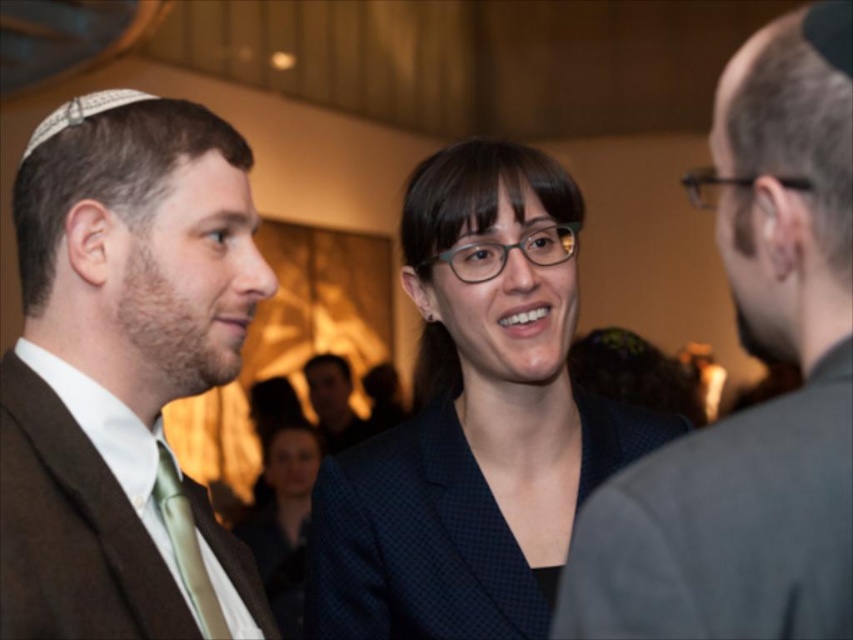
You are a photographer at this event and need to capture a group photo of the dark gray suit at center and the dark blue textured blazer at center. Which clothing item takes up more space in the photo?

The dark gray suit at center takes up more space in the photo because it is larger in size than the dark blue textured blazer at center.

You are a photographer at this event and need to decide which of the two central attendees, the dark gray suit at center or the dark blue textured blazer at center, has a wider garment. Based on their positions, can you determine which one is wider?

The dark gray suit at center is less wide than the dark blue textured blazer at center, so the dark blue textured blazer at center is wider.

You are standing in the reception area and want to take a photo of the point at coordinates point (186, 563). If your camera has a maximum focus range of 30 inches, will you be able to capture the point clearly?

The point (186, 563) is 32.85 inches from the viewer, which exceeds the camera maximum focus range of 30 inches. Therefore, you won t be able to capture the point clearly.